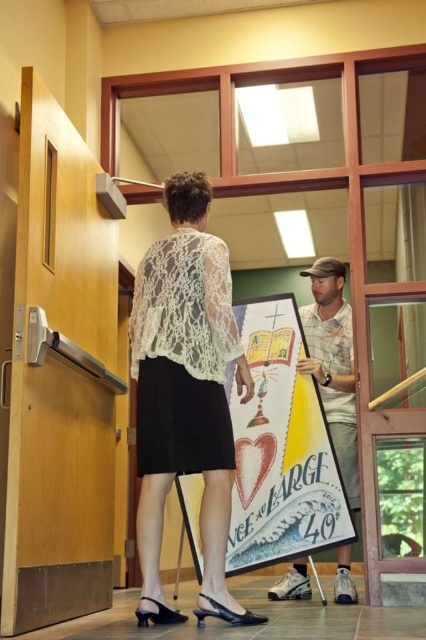
Is white lace blouse at center bigger than matte paper poster at center?

Actually, white lace blouse at center might be smaller than matte paper poster at center.

Measure the distance between white lace blouse at center and camera.

white lace blouse at center is 7.60 feet from camera.

Identify the location of white lace blouse at center. (186, 394).

Is matte paper poster at center to the left of camouflage fabric shirt at center from the viewer's perspective?

Yes, matte paper poster at center is to the left of camouflage fabric shirt at center.

Can you confirm if matte paper poster at center is wider than camouflage fabric shirt at center?

Yes.

Is point (302, 525) farther from camera compared to point (313, 321)?

No, (302, 525) is closer to viewer.

Locate an element on the screen. matte paper poster at center is located at coordinates (281, 448).

Looking at this image, which is more to the left, white lace blouse at center or camouflage fabric shirt at center?

From the viewer's perspective, white lace blouse at center appears more on the left side.

Is white lace blouse at center taller than camouflage fabric shirt at center?

Indeed, white lace blouse at center has a greater height compared to camouflage fabric shirt at center.

This screenshot has height=640, width=426. In order to click on white lace blouse at center in this screenshot , I will do (x=186, y=394).